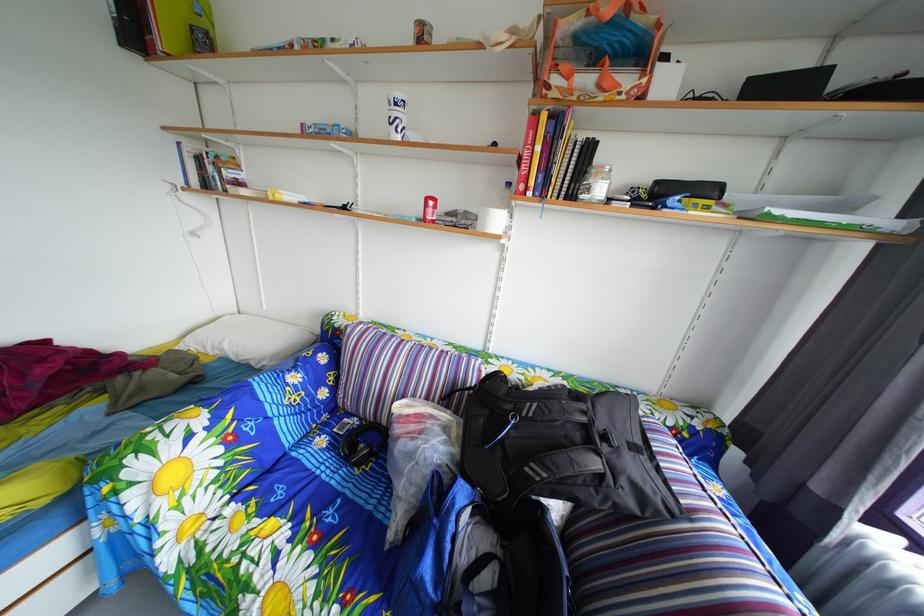
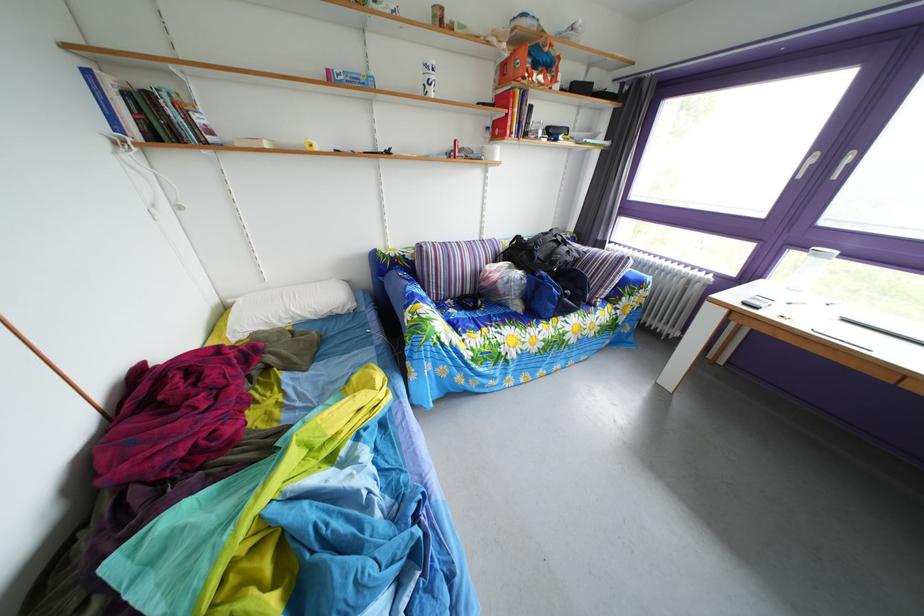
Locate, in the second image, the point that corresponds to point (519, 193) in the first image.

(499, 137)